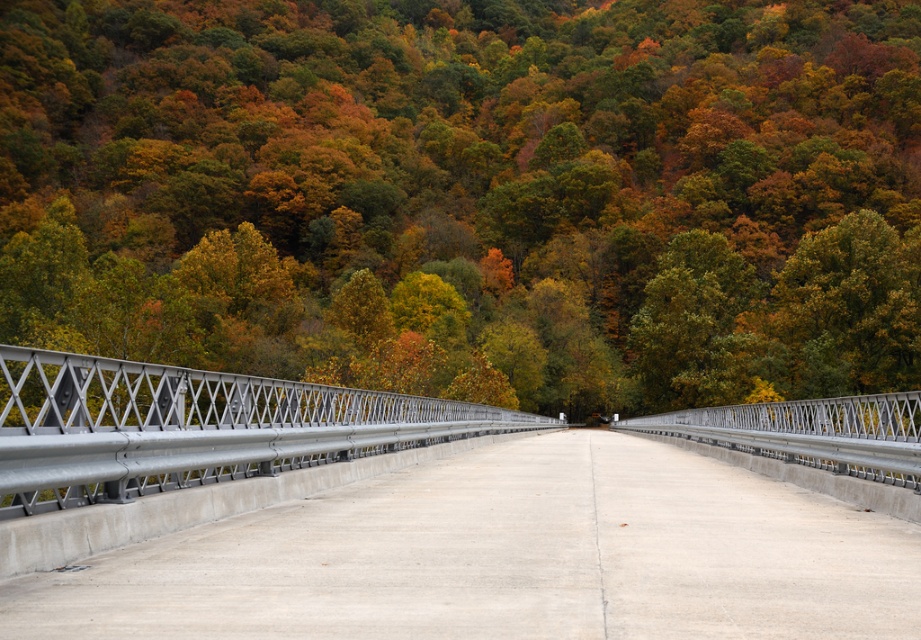
Between metallic bridge at center and metallic gray highway at center, which one is positioned lower?

metallic gray highway at center

Who is positioned more to the right, metallic bridge at center or metallic gray highway at center?

From the viewer's perspective, metallic gray highway at center appears more on the right side.

Is point (324, 77) closer to camera compared to point (565, 513)?

No, it is not.

Locate an element on the screen. The width and height of the screenshot is (921, 640). metallic bridge at center is located at coordinates (470, 193).

From the picture: Which is below, metallic gray highway at center or green matte tree at center?

metallic gray highway at center is below.

Which is in front, point (595, 499) or point (724, 360)?

Point (595, 499)

Between point (591, 509) and point (710, 371), which one is positioned in front?

Point (591, 509)

The image size is (921, 640). In order to click on metallic gray highway at center in this screenshot , I will do `click(507, 557)`.

Between point (153, 428) and point (698, 332), which one is positioned behind?

Point (698, 332)

Is metallic gray bridge at center closer to camera compared to green matte tree at center?

That is True.

Between point (218, 477) and point (713, 332), which one is positioned behind?

The point (713, 332) is more distant.

The width and height of the screenshot is (921, 640). I want to click on metallic gray bridge at center, so click(193, 426).